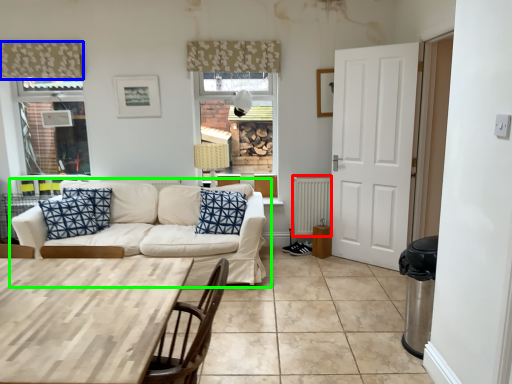
Question: Estimate the real-world distances between objects in this image. Which object is closer to radiator (highlighted by a red box), curtain (highlighted by a blue box) or studio couch (highlighted by a green box)?

Choices:
 (A) curtain
 (B) studio couch

Answer: (B)